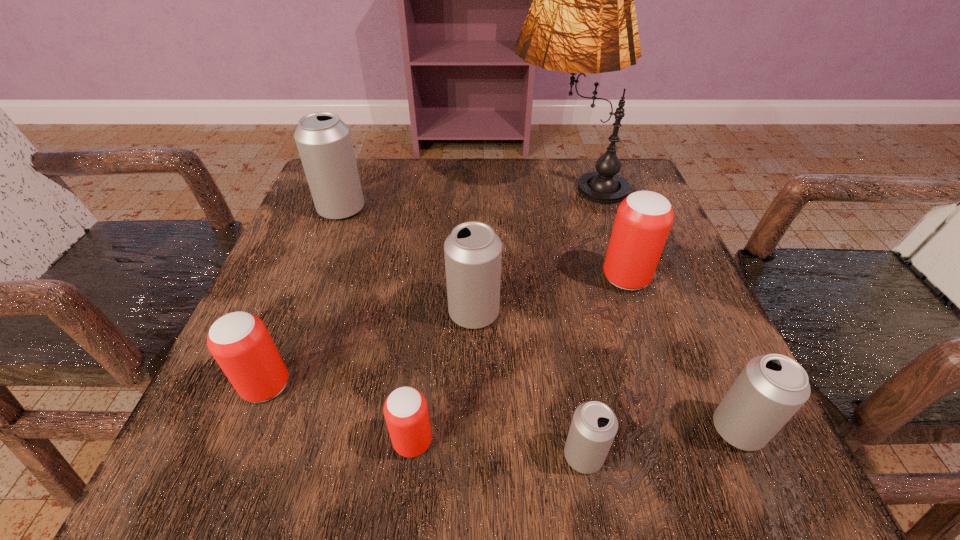
This screenshot has width=960, height=540. Find the location of `object situated at the near right corner`. object situated at the near right corner is located at coordinates (771, 388).

Identify the location of blank area at the far edge. (559, 195).

In the image, there is a desktop. Identify the location of free space at the near edge. (412, 472).

You are a GUI agent. You are given a task and a screenshot of the screen. Output one action in this format:
    pyautogui.click(x=<x>, y=<y>)
    Task: Click on the vacant area at the left edge of the desktop
    The width and height of the screenshot is (960, 540).
    Given the screenshot: What is the action you would take?
    [321, 348]

Where is `free space at the right edge of the desktop`? The image size is (960, 540). free space at the right edge of the desktop is located at coordinates (640, 290).

I want to click on free spot at the far left corner of the desktop, so click(393, 159).

The height and width of the screenshot is (540, 960). In order to click on free space at the near left corner in this screenshot , I will do `click(251, 443)`.

This screenshot has height=540, width=960. I want to click on vacant region at the far right corner of the desktop, so click(x=578, y=163).

The height and width of the screenshot is (540, 960). I want to click on free space between the second smallest red beer can and the lampshade, so click(416, 285).

The width and height of the screenshot is (960, 540). I want to click on vacant area that lies between the fifth beer can from left to right and the third biggest white beer can, so click(660, 442).